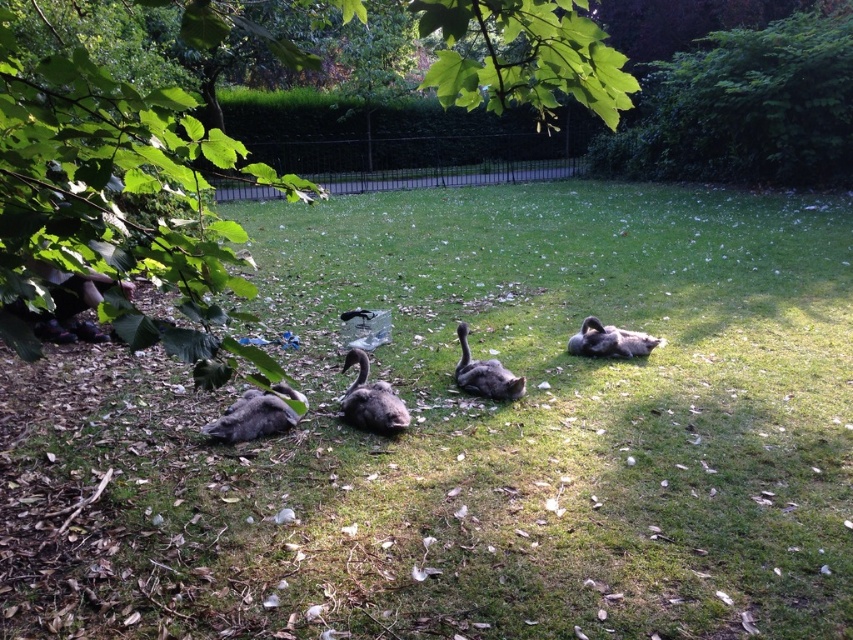
Question: Is green grassy at center bigger than gray downy duckling at center?

Choices:
 (A) yes
 (B) no

Answer: (A)

Question: Does gray downy goose at center have a smaller size compared to gray downy duckling at center?

Choices:
 (A) yes
 (B) no

Answer: (B)

Question: Which of the following is the farthest from the observer?

Choices:
 (A) gray downy duckling at center
 (B) gray downy goose at center
 (C) green leafy tree at center
 (D) green grassy at center

Answer: (A)

Question: Which point is closer to the camera?

Choices:
 (A) (267, 392)
 (B) (521, 381)

Answer: (A)

Question: Which of the following is the closest to the observer?

Choices:
 (A) (173, 138)
 (B) (358, 355)
 (C) (808, 461)
 (D) (587, 339)

Answer: (A)

Question: From the image, what is the correct spatial relationship of green leafy tree at center in relation to gray downy duckling at center?

Choices:
 (A) right
 (B) left

Answer: (B)